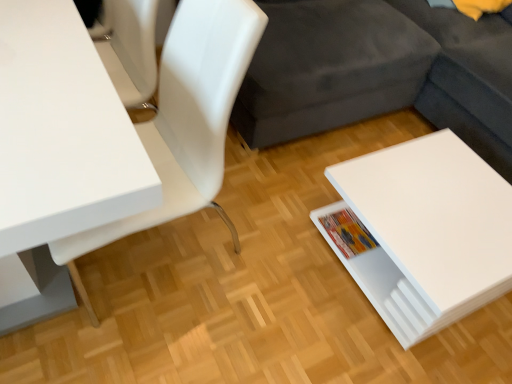
Find the location of a particular element. vacant area situated to the left side of multicolored paper book at lower right is located at coordinates (300, 233).